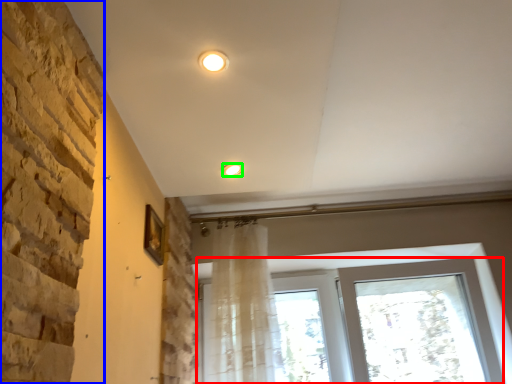
Question: Which object is the farthest from window (highlighted by a red box)? Choose among these: brickwork (highlighted by a blue box) or lighting (highlighted by a green box).

Choices:
 (A) brickwork
 (B) lighting

Answer: (A)